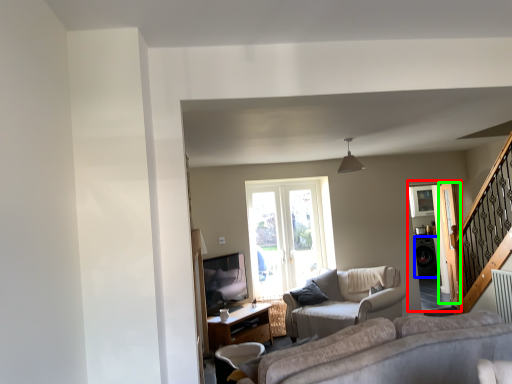
Question: Which object is positioned farthest from screen door (highlighted by a red box)? Select from appliance (highlighted by a blue box) and screen door (highlighted by a green box).

Choices:
 (A) appliance
 (B) screen door

Answer: (A)